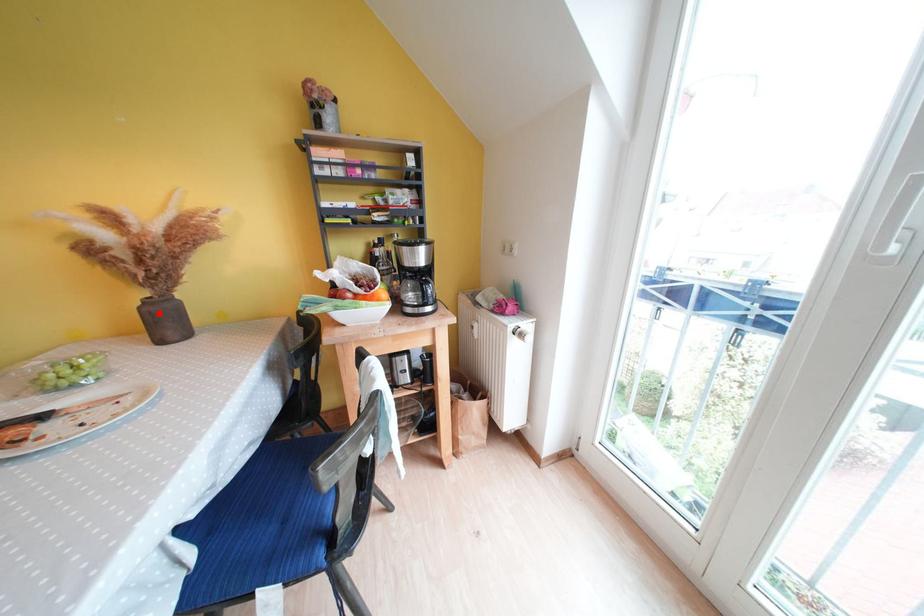
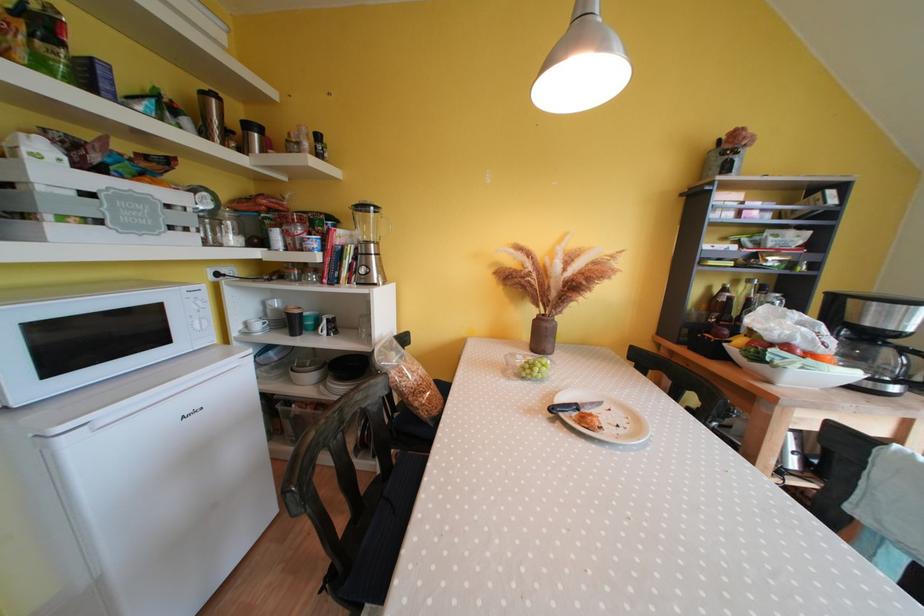
In the second image, find the point that corresponds to the highlighted location in the first image.

(554, 330)